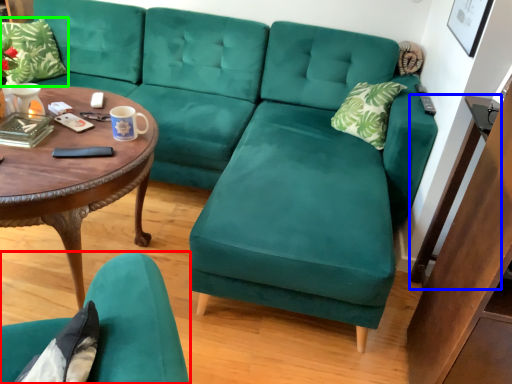
Question: Which object is positioned closest to chair (highlighted by a red box)? Select from side table (highlighted by a blue box) and pillow (highlighted by a green box).

Choices:
 (A) side table
 (B) pillow

Answer: (A)